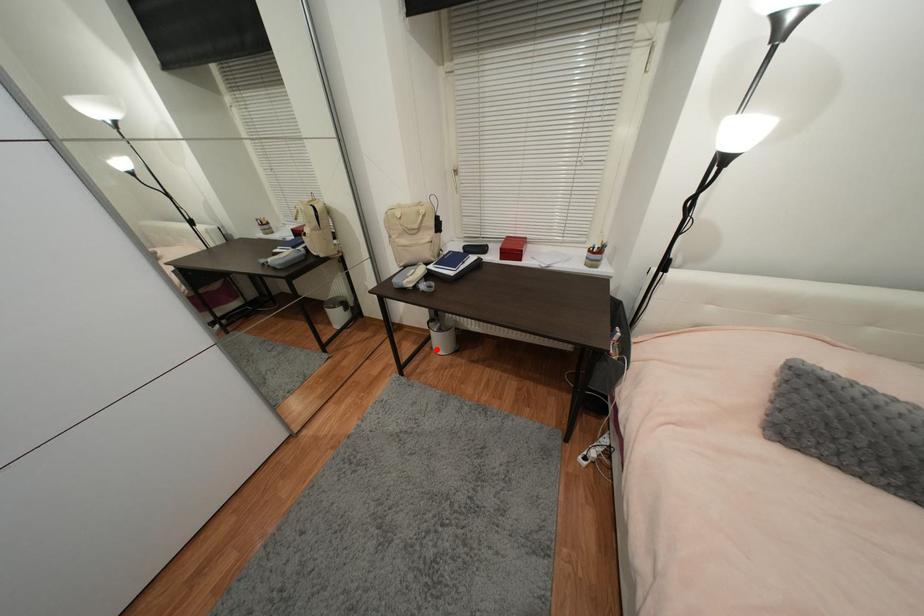
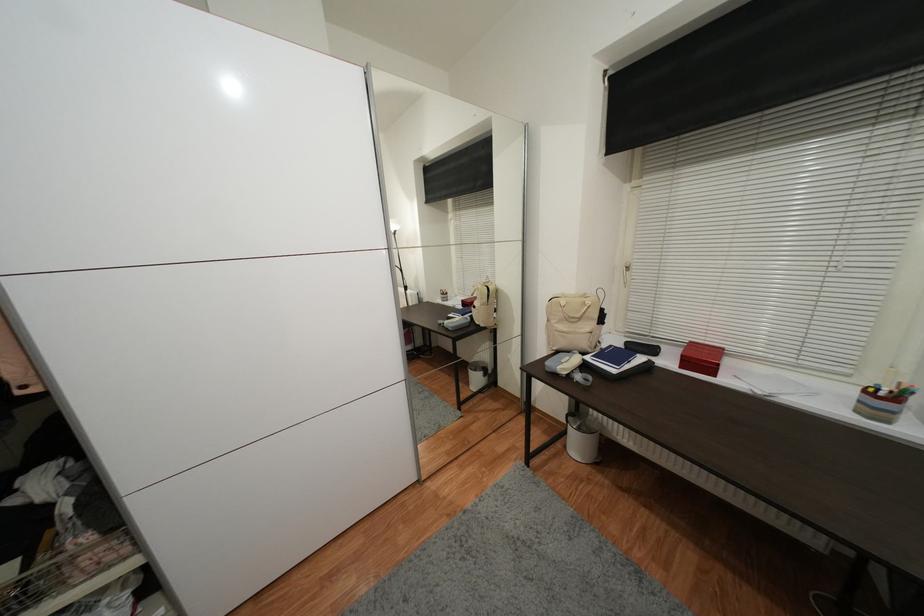
Question: A red point is marked in image1. In image2, is the corresponding 3D point closer to the camera or farther? Reply with the corresponding letter.

Choices:
 (A) The corresponding 3D point is closer.
 (B) The corresponding 3D point is farther.

Answer: (A)